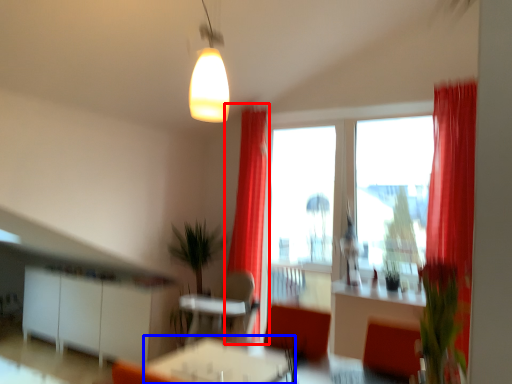
Question: Which object appears closest to the camera in this image, curtain (highlighted by a red box) or table (highlighted by a blue box)?

Choices:
 (A) curtain
 (B) table

Answer: (B)